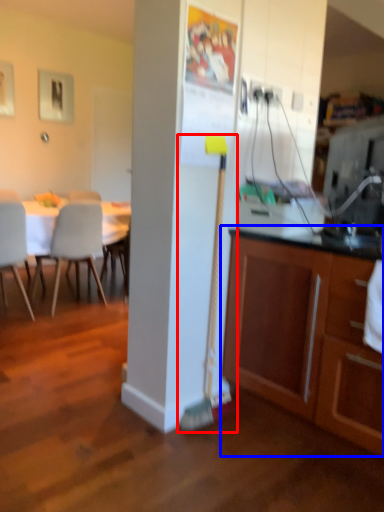
Question: Among these objects, which one is nearest to the camera, brush (highlighted by a red box) or cabinetry (highlighted by a blue box)?

Choices:
 (A) brush
 (B) cabinetry

Answer: (B)